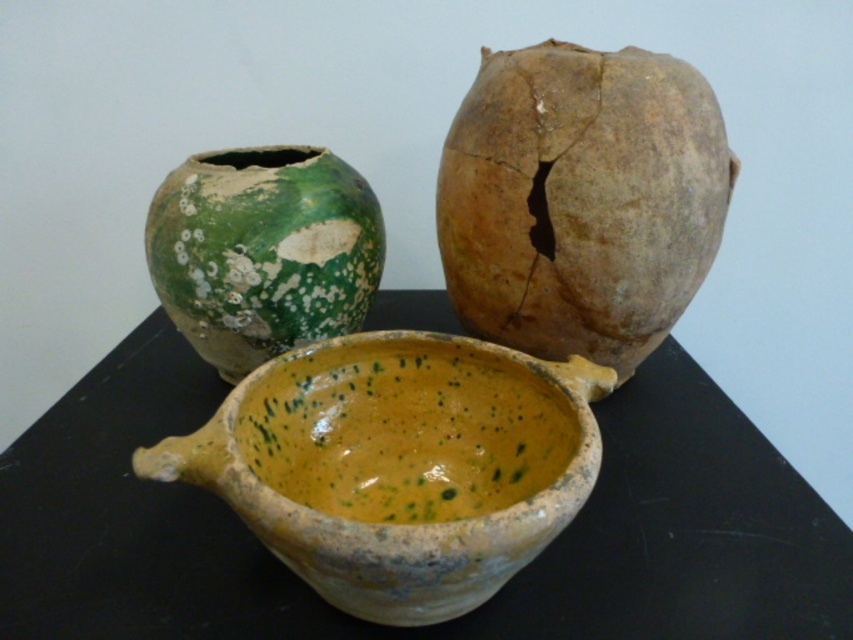
Question: Is speckled clay soup bowl at center wider than speckled clay bowl at center?

Choices:
 (A) yes
 (B) no

Answer: (A)

Question: Which point is closer to the camera?

Choices:
 (A) green speckled clay vase at upper left
 (B) speckled clay vase at upper right
 (C) yellow speckled clay bowl at center
 (D) speckled clay soup bowl at center

Answer: (D)

Question: Among these points, which one is nearest to the camera?

Choices:
 (A) (207, 458)
 (B) (766, 504)
 (C) (258, 236)
 (D) (659, 300)

Answer: (A)

Question: Does speckled clay vase at upper right have a smaller size compared to green speckled clay vase at upper left?

Choices:
 (A) no
 (B) yes

Answer: (A)

Question: Is yellow speckled clay bowl at center closer to the viewer compared to green speckled clay vase at upper left?

Choices:
 (A) no
 (B) yes

Answer: (B)

Question: Estimate the real-world distances between objects in this image. Which object is closer to the green speckled clay vase at upper left?

Choices:
 (A) yellow speckled clay bowl at center
 (B) speckled clay soup bowl at center

Answer: (B)